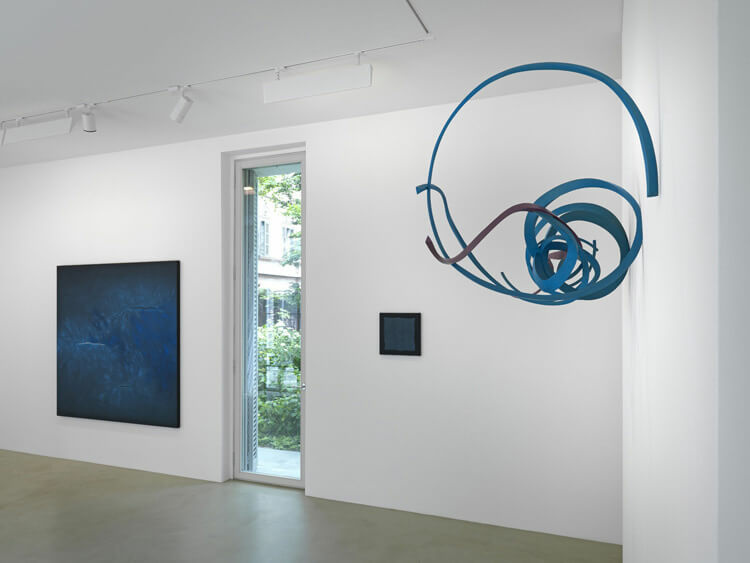
Identify the location of blinds. This screenshot has width=750, height=563. (247, 220).